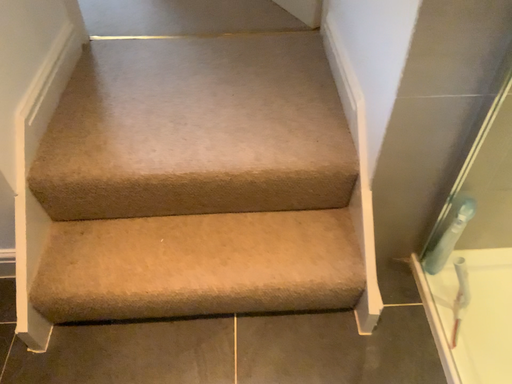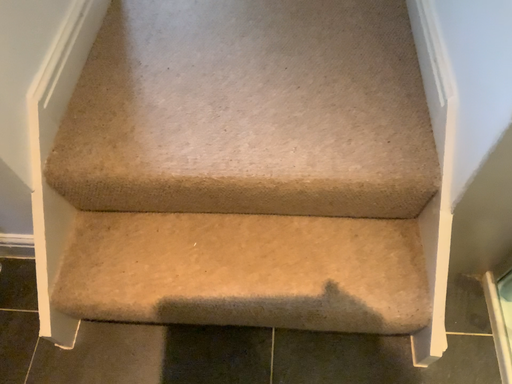
Question: Which way did the camera rotate in the video?

Choices:
 (A) rotated right
 (B) rotated left

Answer: (B)